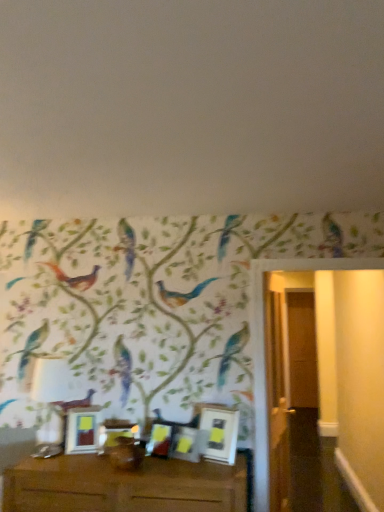
Locate an element on the screen. matte white picture frame at center, the first picture frame from the left is located at coordinates (82, 430).

Describe the element at coordinates (115, 434) in the screenshot. The width and height of the screenshot is (384, 512). I see `matte gold picture frame at center, the 4th picture frame when ordered from right to left` at that location.

In order to click on matte white picture frame at center, which is the 3th picture frame from right to left in this screenshot , I will do (x=159, y=440).

How much distance is there between brown wooden table at lower center and matte gold picture frame at center, the 4th picture frame when ordered from right to left?

brown wooden table at lower center and matte gold picture frame at center, the 4th picture frame when ordered from right to left, are 14.72 inches apart from each other.

Is brown wooden table at lower center oriented towards matte gold picture frame at center, which is the 2th picture frame from left to right?

No.

From the image's perspective, is brown wooden table at lower center located beneath matte gold picture frame at center, which is the 2th picture frame from left to right?

Indeed, from the image's perspective, brown wooden table at lower center is shown beneath matte gold picture frame at center, which is the 2th picture frame from left to right.

Which is nearer, (82, 473) or (107, 446)?

Point (82, 473) appears to be closer to the viewer than point (107, 446).

Between matte white picture frame at center, which ranks as the 5th picture frame in right-to-left order, and matte gold picture frame at center, which is the 2th picture frame from left to right, which one appears on the right side from the viewer's perspective?

From the viewer's perspective, matte gold picture frame at center, which is the 2th picture frame from left to right, appears more on the right side.

From the image's perspective, between matte white picture frame at center, which ranks as the 5th picture frame in right-to-left order, and matte gold picture frame at center, the 4th picture frame when ordered from right to left, who is located below?

From the image's view, matte gold picture frame at center, the 4th picture frame when ordered from right to left, is below.

From a real-world perspective, which is physically below, matte white picture frame at center, the first picture frame from the left, or matte gold picture frame at center, the 4th picture frame when ordered from right to left?

From a 3D spatial view, matte gold picture frame at center, the 4th picture frame when ordered from right to left, is below.

Relative to matte gold picture frame at center, the 4th picture frame when ordered from right to left, is matte white picture frame at center, which ranks as the 5th picture frame in right-to-left order, in front or behind?

In the image, matte white picture frame at center, which ranks as the 5th picture frame in right-to-left order, appears behind matte gold picture frame at center, the 4th picture frame when ordered from right to left.

Does brown wooden table at lower center appear on the right side of matte white picture frame at center, the second picture frame from the right?

No, brown wooden table at lower center is not to the right of matte white picture frame at center, the second picture frame from the right.

Is brown wooden table at lower center looking in the opposite direction of matte white picture frame at center, which appears as the 4th picture frame when viewed from the left?

That's not correct — brown wooden table at lower center is not looking away from matte white picture frame at center, which appears as the 4th picture frame when viewed from the left.

Who is shorter, brown wooden table at lower center or matte white picture frame at center, which appears as the 4th picture frame when viewed from the left?

Standing shorter between the two is matte white picture frame at center, which appears as the 4th picture frame when viewed from the left.

From the image's perspective, relative to matte white picture frame at center, the second picture frame from the right, is brown wooden table at lower center above or below?

Based on their image positions, brown wooden table at lower center is located beneath matte white picture frame at center, the second picture frame from the right.

The height and width of the screenshot is (512, 384). I want to click on the 1st picture frame behind the matte white picture frame at center, which is counted as the 3th picture frame, starting from the left, so click(x=115, y=434).

From the picture: Can you tell me how much matte white picture frame at center, which is the 3th picture frame from right to left, and matte gold picture frame at center, the 4th picture frame when ordered from right to left, differ in facing direction?

The facing directions of matte white picture frame at center, which is the 3th picture frame from right to left, and matte gold picture frame at center, the 4th picture frame when ordered from right to left, are 30.6 degrees apart.

From the image's perspective, is matte white picture frame at center, which is the 3th picture frame from right to left, located above or below matte gold picture frame at center, which is the 2th picture frame from left to right?

From the image's perspective, matte white picture frame at center, which is the 3th picture frame from right to left, appears above matte gold picture frame at center, which is the 2th picture frame from left to right.

Is matte white picture frame at center, which is counted as the 3th picture frame, starting from the left, facing towards matte gold picture frame at center, which is the 2th picture frame from left to right?

No, matte white picture frame at center, which is counted as the 3th picture frame, starting from the left, is not oriented towards matte gold picture frame at center, which is the 2th picture frame from left to right.

How distant is matte white picture frame at center, which is counted as the 3th picture frame, starting from the left, from matte white picture frame at center, which appears as the 4th picture frame when viewed from the left?

matte white picture frame at center, which is counted as the 3th picture frame, starting from the left, and matte white picture frame at center, which appears as the 4th picture frame when viewed from the left, are 4.03 inches apart from each other.

Consider the image. Is matte white picture frame at center, which is counted as the 3th picture frame, starting from the left, oriented away from matte white picture frame at center, the second picture frame from the right?

No, matte white picture frame at center, which is counted as the 3th picture frame, starting from the left, is not facing the opposite direction of matte white picture frame at center, the second picture frame from the right.

Is matte white picture frame at center, which is counted as the 3th picture frame, starting from the left, not near matte white picture frame at center, which appears as the 4th picture frame when viewed from the left?

No, there isn't a large distance between matte white picture frame at center, which is counted as the 3th picture frame, starting from the left, and matte white picture frame at center, which appears as the 4th picture frame when viewed from the left.

This screenshot has height=512, width=384. I want to click on the 1st picture frame above when counting from the matte white picture frame at center, which is counted as the 3th picture frame, starting from the left (from the image's perspective), so click(x=185, y=444).

Considering the sizes of matte white picture frame at center, which appears as the 4th picture frame when viewed from the left, and brown wooden table at lower center in the image, is matte white picture frame at center, which appears as the 4th picture frame when viewed from the left, bigger or smaller than brown wooden table at lower center?

In the image, matte white picture frame at center, which appears as the 4th picture frame when viewed from the left, appears to be smaller than brown wooden table at lower center.

From the picture: Between matte white picture frame at center, the second picture frame from the right, and brown wooden table at lower center, which one is positioned in front?

brown wooden table at lower center is more forward.

Does matte white picture frame at center, the second picture frame from the right, appear on the right side of brown wooden table at lower center?

Correct, you'll find matte white picture frame at center, the second picture frame from the right, to the right of brown wooden table at lower center.

Considering the relative sizes of matte white picture frame at center, the second picture frame from the right, and brown wooden table at lower center in the image provided, is matte white picture frame at center, the second picture frame from the right, taller than brown wooden table at lower center?

In fact, matte white picture frame at center, the second picture frame from the right, may be shorter than brown wooden table at lower center.

From a real-world perspective, is matte white picture frame at center, which ranks as the 5th picture frame in right-to-left order, located higher than matte white picture frame at center, the 1th picture frame from the right?

No, from a real-world perspective, matte white picture frame at center, which ranks as the 5th picture frame in right-to-left order, is not on top of matte white picture frame at center, the 1th picture frame from the right.

Which object is wider, matte white picture frame at center, which ranks as the 5th picture frame in right-to-left order, or matte white picture frame at center, the 1th picture frame from the right?

With larger width is matte white picture frame at center, which ranks as the 5th picture frame in right-to-left order.

Is matte white picture frame at center, the first picture frame from the left, looking in the opposite direction of matte white picture frame at center, the fifth picture frame in the left-to-right sequence?

No, matte white picture frame at center, the first picture frame from the left, is not facing away from matte white picture frame at center, the fifth picture frame in the left-to-right sequence.

Is matte white picture frame at center, which ranks as the 5th picture frame in right-to-left order, to the right of matte white picture frame at center, the 1th picture frame from the right, from the viewer's perspective?

No, matte white picture frame at center, which ranks as the 5th picture frame in right-to-left order, is not to the right of matte white picture frame at center, the 1th picture frame from the right.

The width and height of the screenshot is (384, 512). I want to click on table that is in front of the matte gold picture frame at center, the 4th picture frame when ordered from right to left, so click(x=124, y=486).

The image size is (384, 512). I want to click on the 3rd picture frame positioned below the matte white picture frame at center, which ranks as the 5th picture frame in right-to-left order (from the image's perspective), so click(115, 434).

Considering their positions, is matte white picture frame at center, the fifth picture frame in the left-to-right sequence, positioned further to matte white picture frame at center, which ranks as the 5th picture frame in right-to-left order, than matte white picture frame at center, which appears as the 4th picture frame when viewed from the left?

matte white picture frame at center, the fifth picture frame in the left-to-right sequence, is further to matte white picture frame at center, which ranks as the 5th picture frame in right-to-left order.

Looking at the image, which one is located further to matte white picture frame at center, which appears as the 4th picture frame when viewed from the left, brown wooden table at lower center or matte gold picture frame at center, the 4th picture frame when ordered from right to left?

brown wooden table at lower center is positioned further to the anchor matte white picture frame at center, which appears as the 4th picture frame when viewed from the left.

When comparing their distances from matte white picture frame at center, which is counted as the 3th picture frame, starting from the left, does matte white picture frame at center, which ranks as the 5th picture frame in right-to-left order, or matte white picture frame at center, the second picture frame from the right, seem closer?

matte white picture frame at center, the second picture frame from the right, lies closer to matte white picture frame at center, which is counted as the 3th picture frame, starting from the left, than the other object.

Looking at the image, which one is located closer to matte white picture frame at center, which is the 3th picture frame from right to left, matte gold picture frame at center, the 4th picture frame when ordered from right to left, or matte white picture frame at center, which appears as the 4th picture frame when viewed from the left?

Among the two, matte white picture frame at center, which appears as the 4th picture frame when viewed from the left, is located nearer to matte white picture frame at center, which is the 3th picture frame from right to left.

Looking at the image, which one is located closer to matte white picture frame at center, the first picture frame from the left, matte white picture frame at center, the fifth picture frame in the left-to-right sequence, or matte gold picture frame at center, the 4th picture frame when ordered from right to left?

matte gold picture frame at center, the 4th picture frame when ordered from right to left, lies closer to matte white picture frame at center, the first picture frame from the left, than the other object.

Looking at this image, based on their spatial positions, is matte white picture frame at center, the first picture frame from the left, or matte white picture frame at center, the 1th picture frame from the right, further from matte gold picture frame at center, the 4th picture frame when ordered from right to left?

The object further to matte gold picture frame at center, the 4th picture frame when ordered from right to left, is matte white picture frame at center, the 1th picture frame from the right.

From the image, which object appears to be nearer to matte white picture frame at center, the first picture frame from the left, matte white picture frame at center, which appears as the 4th picture frame when viewed from the left, or brown wooden table at lower center?

The object closer to matte white picture frame at center, the first picture frame from the left, is brown wooden table at lower center.

From the image, which object appears to be farther from matte white picture frame at center, the second picture frame from the right, brown wooden table at lower center or matte white picture frame at center, the 1th picture frame from the right?

brown wooden table at lower center lies further to matte white picture frame at center, the second picture frame from the right, than the other object.

Locate an element on the screen. picture frame located between matte gold picture frame at center, which is the 2th picture frame from left to right, and matte white picture frame at center, the second picture frame from the right, in the left-right direction is located at coordinates (159, 440).

Identify the location of picture frame between matte white picture frame at center, which is the 3th picture frame from right to left, and matte white picture frame at center, the fifth picture frame in the left-to-right sequence, in the horizontal direction. This screenshot has height=512, width=384. (185, 444).

This screenshot has height=512, width=384. In order to click on table situated between matte gold picture frame at center, which is the 2th picture frame from left to right, and matte white picture frame at center, the 1th picture frame from the right, from left to right in this screenshot , I will do `click(124, 486)`.

At what (x,y) coordinates should I click in order to perform the action: click on table between matte white picture frame at center, the first picture frame from the left, and matte white picture frame at center, the second picture frame from the right, from left to right. Please return your answer as a coordinate pair (x, y). This screenshot has height=512, width=384. Looking at the image, I should click on (124, 486).